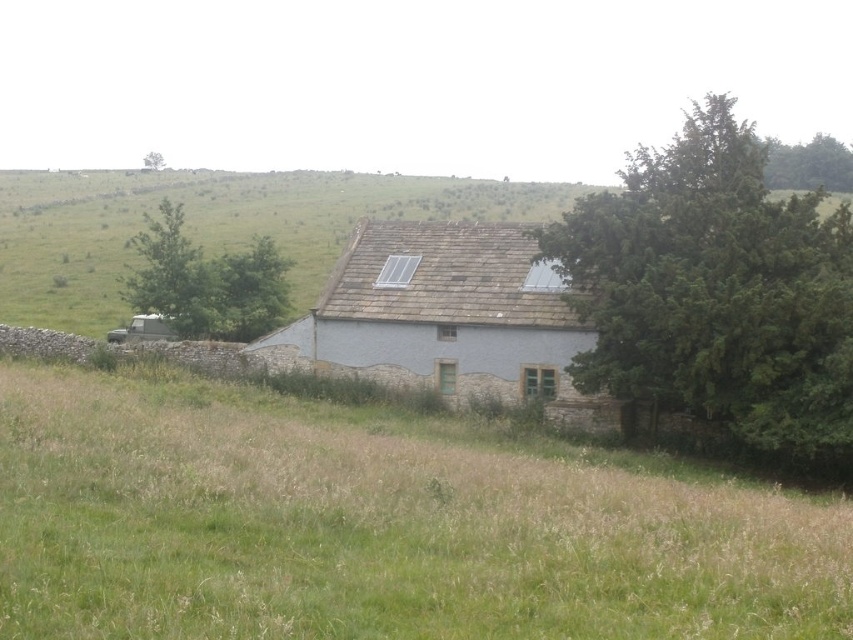
Question: Does white stone cottage at center appear over green leafy tree at upper right?

Choices:
 (A) yes
 (B) no

Answer: (B)

Question: Where is green grass at center located in relation to green leafy tree at upper center in the image?

Choices:
 (A) right
 (B) left

Answer: (A)

Question: Which object is positioned farthest from the white stone cottage at center?

Choices:
 (A) gray stone house at center
 (B) green leafy tree at upper center
 (C) green grass at center

Answer: (B)

Question: Which point is closer to the camera?

Choices:
 (A) green leafy tree at left
 (B) white stone cottage at center
 (C) gray stone house at center

Answer: (C)

Question: Is gray stone house at center below green leafy tree at upper center?

Choices:
 (A) yes
 (B) no

Answer: (A)

Question: Which object is closer to the camera taking this photo?

Choices:
 (A) green grass at center
 (B) gray stone house at center

Answer: (A)